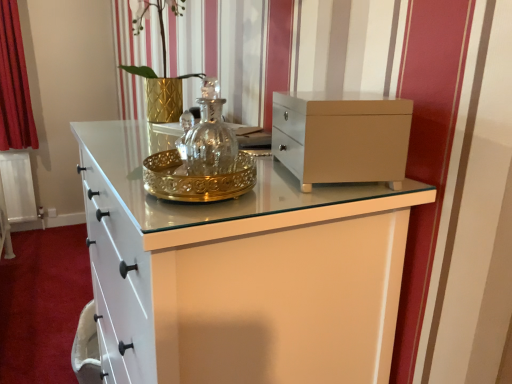
The image size is (512, 384). I want to click on red velvet curtain at left, so pos(14,84).

Measure the distance between point (22, 100) and camera.

The depth of point (22, 100) is 3.49 meters.

Measure the distance between red velvet curtain at left and camera.

red velvet curtain at left is 10.61 feet from camera.

Describe the element at coordinates (14, 84) in the screenshot. Image resolution: width=512 pixels, height=384 pixels. I see `red velvet curtain at left` at that location.

The height and width of the screenshot is (384, 512). Describe the element at coordinates (342, 137) in the screenshot. I see `matte beige chest at upper center` at that location.

Measure the distance between point (406, 151) and camera.

Point (406, 151) and camera are 28.46 inches apart.

In order to face matte beige chest at upper center, should I rotate leftwards or rightwards?

You should look right and rotate roughly 10.005 degrees.

You are a GUI agent. You are given a task and a screenshot of the screen. Output one action in this format:
    pyautogui.click(x=<x>, y=<y>)
    Task: Click on the matte beige chest at upper center
    The height and width of the screenshot is (384, 512).
    Given the screenshot: What is the action you would take?
    pos(342,137)

Where is `red velvet curtain at left`? The width and height of the screenshot is (512, 384). red velvet curtain at left is located at coordinates (14, 84).

Is red velvet curtain at left to the left or to the right of matte beige chest at upper center in the image?

Clearly, red velvet curtain at left is on the left of matte beige chest at upper center in the image.

Which object is more forward, red velvet curtain at left or matte beige chest at upper center?

Positioned in front is matte beige chest at upper center.

Is point (12, 96) closer to viewer compared to point (295, 101)?

That is False.

In the scene shown: From the image's perspective, is red velvet curtain at left under matte beige chest at upper center?

No.

From a real-world perspective, is red velvet curtain at left physically located above or below matte beige chest at upper center?

red velvet curtain at left is below matte beige chest at upper center.

Is red velvet curtain at left wider than matte beige chest at upper center?

Yes, red velvet curtain at left is wider than matte beige chest at upper center.

Between red velvet curtain at left and matte beige chest at upper center, which one has less height?

matte beige chest at upper center is shorter.

Considering the sizes of objects red velvet curtain at left and matte beige chest at upper center in the image provided, who is smaller, red velvet curtain at left or matte beige chest at upper center?

matte beige chest at upper center is smaller.

Is red velvet curtain at left located outside matte beige chest at upper center?

red velvet curtain at left lies outside matte beige chest at upper center's area.

Is red velvet curtain at left in contact with matte beige chest at upper center?

No, red velvet curtain at left is not touching matte beige chest at upper center.

Is red velvet curtain at left facing towards matte beige chest at upper center?

No.

How many degrees apart are the facing directions of red velvet curtain at left and matte beige chest at upper center?

red velvet curtain at left and matte beige chest at upper center are facing 106 degrees away from each other.

Measure the distance between red velvet curtain at left and matte beige chest at upper center.

red velvet curtain at left and matte beige chest at upper center are 10.93 feet apart from each other.

This screenshot has width=512, height=384. What are the coordinates of `chest of drawers located on the right of red velvet curtain at left` in the screenshot? It's located at click(x=342, y=137).

Consider the image. Considering the relative positions of matte beige chest at upper center and red velvet curtain at left in the image provided, is matte beige chest at upper center to the right of red velvet curtain at left from the viewer's perspective?

Indeed, matte beige chest at upper center is positioned on the right side of red velvet curtain at left.

Considering the relative positions of matte beige chest at upper center and red velvet curtain at left in the image provided, is matte beige chest at upper center behind red velvet curtain at left?

No.

Is point (406, 141) behind point (0, 64)?

No, it is in front of (0, 64).

In the scene shown: From the image's perspective, is matte beige chest at upper center beneath red velvet curtain at left?

Indeed, from the image's perspective, matte beige chest at upper center is shown beneath red velvet curtain at left.

From a real-world perspective, which is physically above, matte beige chest at upper center or red velvet curtain at left?

matte beige chest at upper center is physically above.

Considering the sizes of objects matte beige chest at upper center and red velvet curtain at left in the image provided, who is wider, matte beige chest at upper center or red velvet curtain at left?

red velvet curtain at left is wider.

Is matte beige chest at upper center taller or shorter than red velvet curtain at left?

In the image, matte beige chest at upper center appears to be shorter than red velvet curtain at left.

Between matte beige chest at upper center and red velvet curtain at left, which one has larger size?

Bigger between the two is red velvet curtain at left.

Is matte beige chest at upper center not within red velvet curtain at left?

Yes, matte beige chest at upper center is not within red velvet curtain at left.

Looking at this image, would you consider matte beige chest at upper center to be distant from red velvet curtain at left?

That's right, there is a large distance between matte beige chest at upper center and red velvet curtain at left.

Is matte beige chest at upper center oriented towards red velvet curtain at left?

No, matte beige chest at upper center is not turned towards red velvet curtain at left.

How many degrees apart are the facing directions of matte beige chest at upper center and red velvet curtain at left?

106 degrees separate the facing orientations of matte beige chest at upper center and red velvet curtain at left.

The image size is (512, 384). In order to click on curtain above the matte beige chest at upper center (from the image's perspective) in this screenshot , I will do `click(14, 84)`.

The image size is (512, 384). I want to click on the chest of drawers above the red velvet curtain at left (from a real-world perspective), so click(342, 137).

The width and height of the screenshot is (512, 384). What are the coordinates of `curtain on the left of matte beige chest at upper center` in the screenshot? It's located at (14, 84).